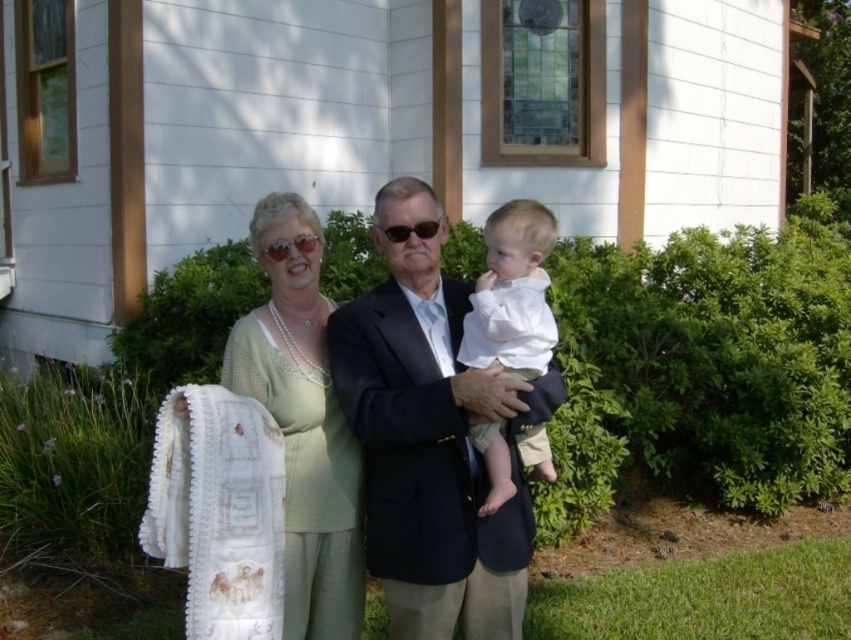
Can you confirm if dark blue suit at center is bigger than white cotton shirt at center?

Correct, dark blue suit at center is larger in size than white cotton shirt at center.

Which is behind, point (440, 272) or point (515, 227)?

The point (440, 272) is behind.

The width and height of the screenshot is (851, 640). Find the location of `dark blue suit at center`. dark blue suit at center is located at coordinates (431, 435).

Which is above, linen dress at center or white cotton shirt at center?

white cotton shirt at center

Find the location of a particular element. This screenshot has width=851, height=640. linen dress at center is located at coordinates (301, 422).

This screenshot has width=851, height=640. What are the coordinates of `linen dress at center` in the screenshot? It's located at (301, 422).

Does dark blue suit at center come in front of linen dress at center?

No, dark blue suit at center is behind linen dress at center.

Who is positioned more to the left, dark blue suit at center or linen dress at center?

Positioned to the left is linen dress at center.

Which is in front, point (421, 440) or point (284, 556)?

Point (421, 440)

At what (x,y) coordinates should I click in order to perform the action: click on dark blue suit at center. Please return your answer as a coordinate pair (x, y). Image resolution: width=851 pixels, height=640 pixels. Looking at the image, I should click on 431,435.